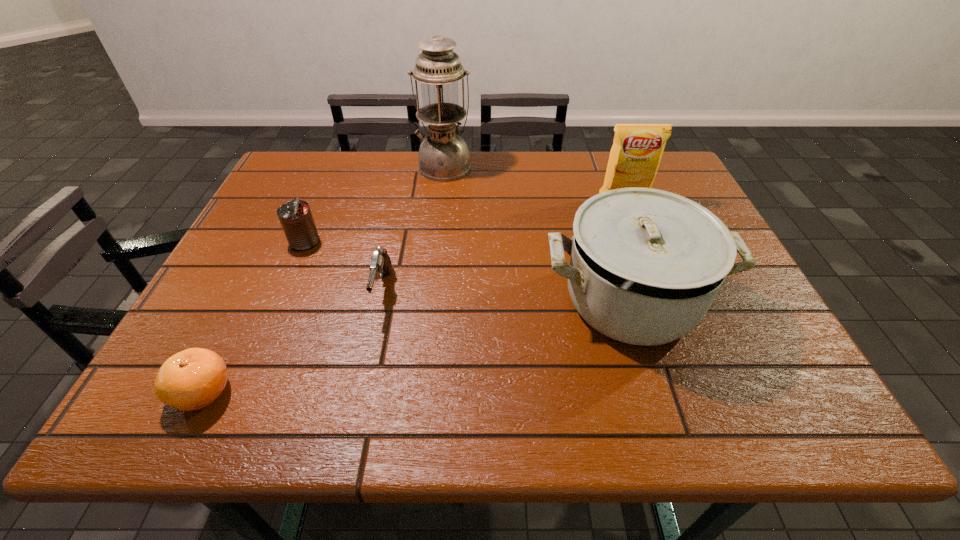
The image size is (960, 540). I want to click on unoccupied position between the tallest object and the can, so click(x=374, y=204).

The image size is (960, 540). Identify the location of empty space that is in between the can and the saucepan. (468, 271).

Locate an element on the screen. Image resolution: width=960 pixels, height=540 pixels. unoccupied area between the third object from right to left and the fifth nearest object is located at coordinates (534, 184).

In order to click on free spot between the can and the fourth object from right to left in this screenshot , I will do `click(344, 266)`.

You are a GUI agent. You are given a task and a screenshot of the screen. Output one action in this format:
    pyautogui.click(x=<x>, y=<y>)
    Task: Click on the vacant space in between the tallest object and the pistol
    
    Given the screenshot: What is the action you would take?
    pyautogui.click(x=414, y=228)

Identify the location of unoccupied area between the farthest object and the second shortest object. (414, 228).

Find the location of `free spot between the fourth object from left to right and the saucepan`. free spot between the fourth object from left to right and the saucepan is located at coordinates (538, 233).

Identify the location of empty space between the third farthest object and the shortest object. (253, 317).

What are the coordinates of `blank region between the second shortest object and the nearest object` in the screenshot? It's located at (293, 341).

Identify the location of vacant space that is in between the fourth object from right to left and the crisp (potato chip). This screenshot has width=960, height=540. tap(503, 246).